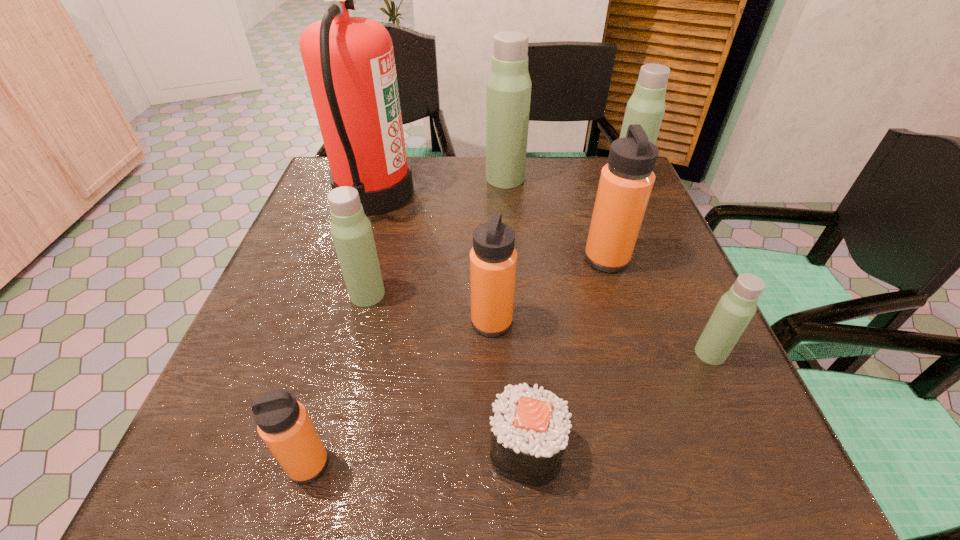
Locate which light thermos bottle is the closest to the tallest thermos bottle. Please provide its 2D coordinates. Your answer should be formatted as a tuple, i.e. [(x, y)], where the tuple contains the x and y coordinates of a point satisfying the conditions above.

[(646, 107)]

Where is `orange thermos bottle that can be found as the third closest to the red fire extinguisher`? The width and height of the screenshot is (960, 540). orange thermos bottle that can be found as the third closest to the red fire extinguisher is located at coordinates (282, 422).

Identify which orange thermos bottle is the second closest to the second smallest light thermos bottle. Please provide its 2D coordinates. Your answer should be formatted as a tuple, i.e. [(x, y)], where the tuple contains the x and y coordinates of a point satisfying the conditions above.

[(282, 422)]

Find the location of a particular element. Image resolution: width=960 pixels, height=540 pixels. free space that satisfies the following two spatial constraints: 1. at the nozzle of the second farthest orange thermos bottle; 2. on the right side of the tallest object is located at coordinates (335, 322).

At what (x,y) coordinates should I click in order to perform the action: click on free space that satisfies the following two spatial constraints: 1. on the back side of the second biggest light thermos bottle; 2. on the right side of the smallest orange thermos bottle. Please return your answer as a coordinate pair (x, y). The width and height of the screenshot is (960, 540). Looking at the image, I should click on (387, 183).

At what (x,y) coordinates should I click in order to perform the action: click on free space that satisfies the following two spatial constraints: 1. at the nozzle of the red fire extinguisher; 2. on the right side of the second biggest orange thermos bottle. Please return your answer as a coordinate pair (x, y). Looking at the image, I should click on click(335, 322).

Where is `free space that satisfies the following two spatial constraints: 1. at the nozzle of the tallest object; 2. on the right side of the farthest orange thermos bottle`? free space that satisfies the following two spatial constraints: 1. at the nozzle of the tallest object; 2. on the right side of the farthest orange thermos bottle is located at coordinates (354, 259).

Where is `vacant space that satisfies the following two spatial constraints: 1. at the nozzle of the second smallest light thermos bottle; 2. on the right side of the red fire extinguisher`? The width and height of the screenshot is (960, 540). vacant space that satisfies the following two spatial constraints: 1. at the nozzle of the second smallest light thermos bottle; 2. on the right side of the red fire extinguisher is located at coordinates (344, 294).